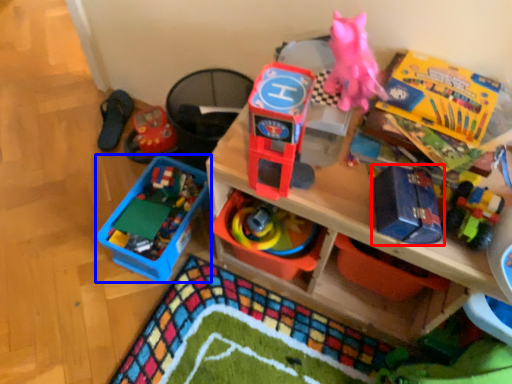
Question: Which object appears farthest to the camera in this image, toy (highlighted by a red box) or toy (highlighted by a blue box)?

Choices:
 (A) toy
 (B) toy

Answer: (B)